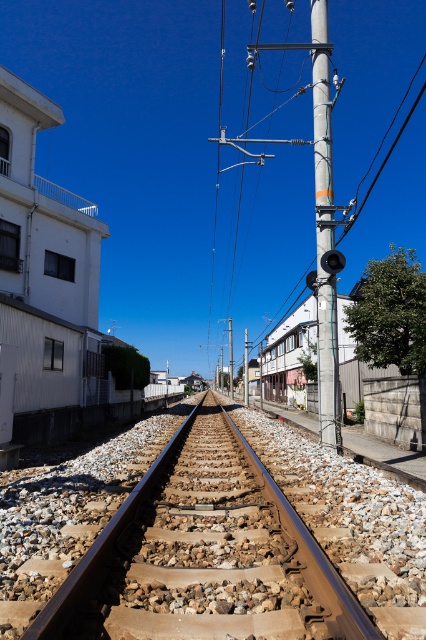
Does brown metal train track at center come behind smooth metallic pole at upper center?

That is False.

Is brown metal train track at center in front of smooth metallic pole at upper center?

Yes, it is in front of smooth metallic pole at upper center.

Which is behind, point (264, 577) or point (379, 147)?

The point (379, 147) is behind.

Identify the location of brown metal train track at center. tap(204, 556).

Does point (247, 572) come closer to viewer compared to point (330, 182)?

That is True.

Is brown metal train track at center smaller than silver metallic pole at center?

Yes, brown metal train track at center is smaller than silver metallic pole at center.

Is point (120, 550) closer to viewer compared to point (322, 93)?

Yes, point (120, 550) is closer to viewer.

You are a GUI agent. You are given a task and a screenshot of the screen. Output one action in this format:
    pyautogui.click(x=<x>, y=<y>)
    Task: Click on the brown metal train track at center
    The width and height of the screenshot is (426, 640).
    Given the screenshot: What is the action you would take?
    [x=204, y=556]

From the picture: Is silver metallic pole at center positioned behind smooth metallic pole at upper center?

No, silver metallic pole at center is closer to the viewer.

Which is in front, point (331, 330) or point (400, 104)?

Positioned in front is point (331, 330).

Which is in front, point (325, 145) or point (411, 108)?

Point (325, 145)

Identify the location of silver metallic pole at center. The height and width of the screenshot is (640, 426). (325, 230).